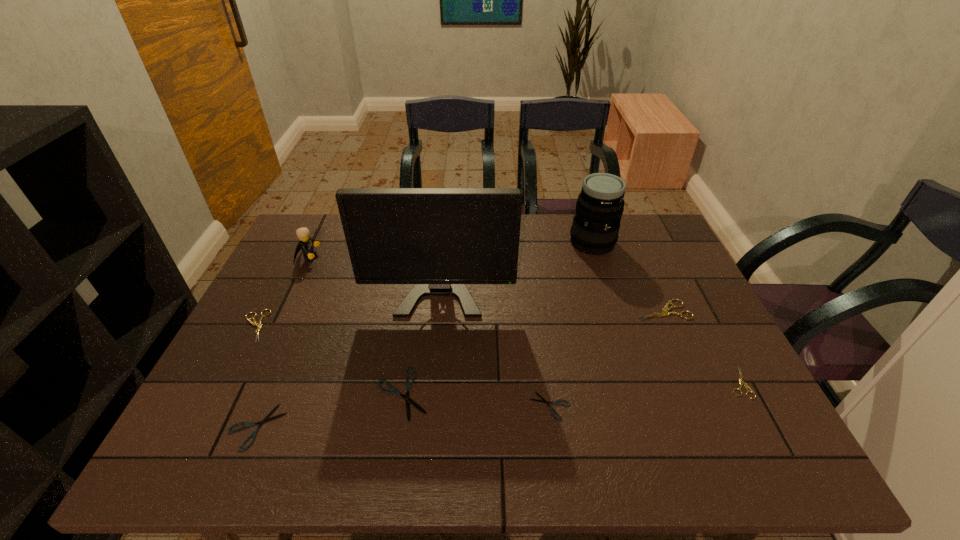
Locate an element on the screen. The width and height of the screenshot is (960, 540). free space between the biggest black shears and the rightmost object is located at coordinates (570, 388).

Image resolution: width=960 pixels, height=540 pixels. What are the coordinates of `vacant space that's between the seventh shortest object and the rightmost beige shears` in the screenshot? It's located at (523, 320).

Where is `free point between the seventh shortest object and the leftmost beige shears`? This screenshot has width=960, height=540. free point between the seventh shortest object and the leftmost beige shears is located at coordinates (281, 292).

This screenshot has height=540, width=960. I want to click on object identified as the third closest to the second biggest beige shears, so pyautogui.click(x=439, y=239).

Image resolution: width=960 pixels, height=540 pixels. In order to click on the second closest object relative to the leftmost black shears in this screenshot , I will do `click(408, 384)`.

Select which shears is the closest to the rightmost black shears. Please provide its 2D coordinates. Your answer should be formatted as a tuple, i.e. [(x, y)], where the tuple contains the x and y coordinates of a point satisfying the conditions above.

[(408, 384)]

This screenshot has width=960, height=540. Find the location of `the second closest shears to the fourth object from right to left`. the second closest shears to the fourth object from right to left is located at coordinates (664, 312).

Point out which beige shears is positioned as the nearest to the rightmost object. Please provide its 2D coordinates. Your answer should be formatted as a tuple, i.e. [(x, y)], where the tuple contains the x and y coordinates of a point satisfying the conditions above.

[(664, 312)]

Locate which beige shears ranks in proximity to the second black shears from left to right. Please provide its 2D coordinates. Your answer should be formatted as a tuple, i.e. [(x, y)], where the tuple contains the x and y coordinates of a point satisfying the conditions above.

[(259, 325)]

Where is `black shears that is the closest to the second tallest object`? This screenshot has height=540, width=960. black shears that is the closest to the second tallest object is located at coordinates (544, 401).